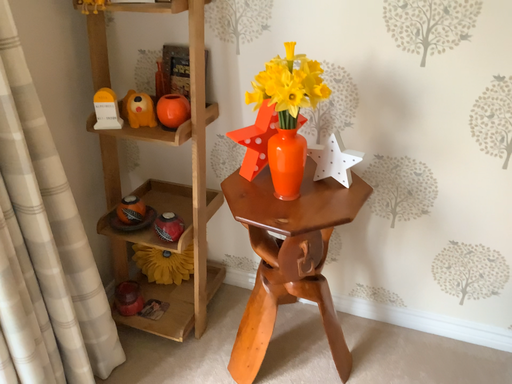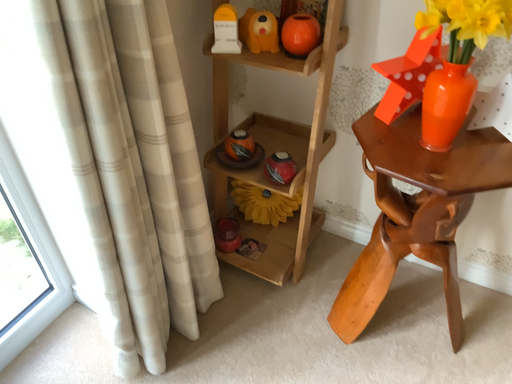
Question: Which way did the camera rotate in the video?

Choices:
 (A) rotated downward
 (B) rotated upward

Answer: (A)